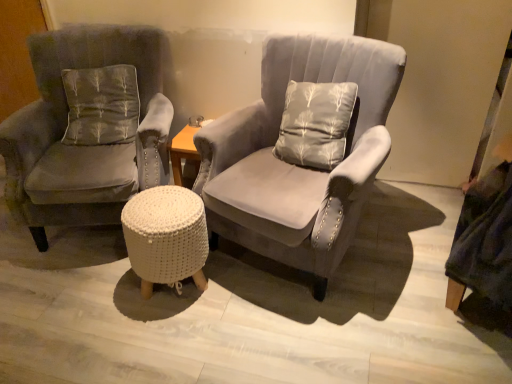
Question: Can you confirm if gray fabric pillow at left is positioned to the left of velvet gray armchair at left, the 2th chair viewed from the right?

Choices:
 (A) yes
 (B) no

Answer: (B)

Question: Is gray fabric pillow at left positioned behind velvet gray armchair at left, which appears as the first chair when viewed from the left?

Choices:
 (A) no
 (B) yes

Answer: (B)

Question: Can you see gray fabric pillow at left touching velvet gray armchair at left, which appears as the first chair when viewed from the left?

Choices:
 (A) yes
 (B) no

Answer: (B)

Question: Is gray fabric pillow at left at the right side of velvet gray armchair at left, which appears as the first chair when viewed from the left?

Choices:
 (A) yes
 (B) no

Answer: (A)

Question: Is gray fabric pillow at left looking in the opposite direction of velvet gray armchair at left, the 2th chair viewed from the right?

Choices:
 (A) no
 (B) yes

Answer: (B)

Question: Does point (162, 246) appear closer or farther from the camera than point (352, 213)?

Choices:
 (A) closer
 (B) farther

Answer: (A)

Question: Looking at their shapes, would you say white knitted stool at center is wider or thinner than suede gray armchair at center, which appears as the second chair when viewed from the left?

Choices:
 (A) thin
 (B) wide

Answer: (A)

Question: From the image's perspective, is white knitted stool at center positioned above or below suede gray armchair at center, which appears as the second chair when viewed from the left?

Choices:
 (A) above
 (B) below

Answer: (B)

Question: Considering the relative positions of white knitted stool at center and suede gray armchair at center, which appears as the second chair when viewed from the left, in the image provided, is white knitted stool at center to the left or to the right of suede gray armchair at center, which appears as the second chair when viewed from the left,?

Choices:
 (A) right
 (B) left

Answer: (B)

Question: From a real-world perspective, is gray fabric pillow at left physically located above or below velvet gray armchair at left, the 2th chair viewed from the right?

Choices:
 (A) below
 (B) above

Answer: (B)

Question: Is gray fabric pillow at left bigger or smaller than velvet gray armchair at left, the 2th chair viewed from the right?

Choices:
 (A) small
 (B) big

Answer: (A)

Question: Is gray fabric pillow at left taller or shorter than velvet gray armchair at left, which appears as the first chair when viewed from the left?

Choices:
 (A) tall
 (B) short

Answer: (B)

Question: Is point (106, 84) closer or farther from the camera than point (96, 173)?

Choices:
 (A) farther
 (B) closer

Answer: (A)

Question: In the image, is velvet gray armchair at left, the 2th chair viewed from the right, positioned in front of or behind gray fabric pillow at left?

Choices:
 (A) front
 (B) behind

Answer: (A)

Question: In terms of width, does velvet gray armchair at left, which appears as the first chair when viewed from the left, look wider or thinner when compared to gray fabric pillow at left?

Choices:
 (A) wide
 (B) thin

Answer: (A)